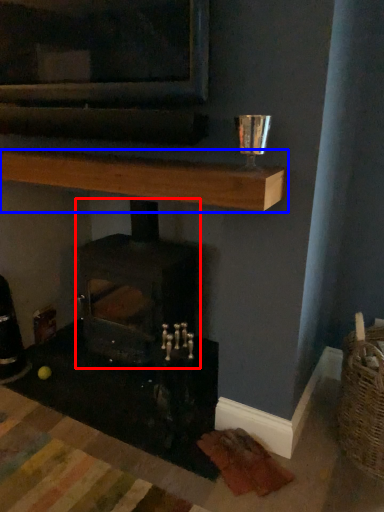
Question: Which point is further to the camera, wood burning stove (highlighted by a red box) or shelf (highlighted by a blue box)?

Choices:
 (A) wood burning stove
 (B) shelf

Answer: (A)